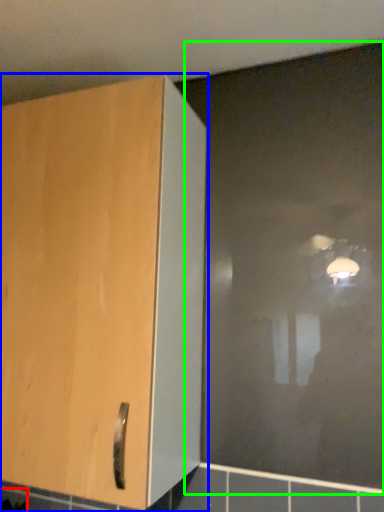
Question: Based on their relative distances, which object is nearer to ceramic tile (highlighted by a red box)? Choose from cupboard (highlighted by a blue box) and glass door (highlighted by a green box).

Choices:
 (A) cupboard
 (B) glass door

Answer: (A)